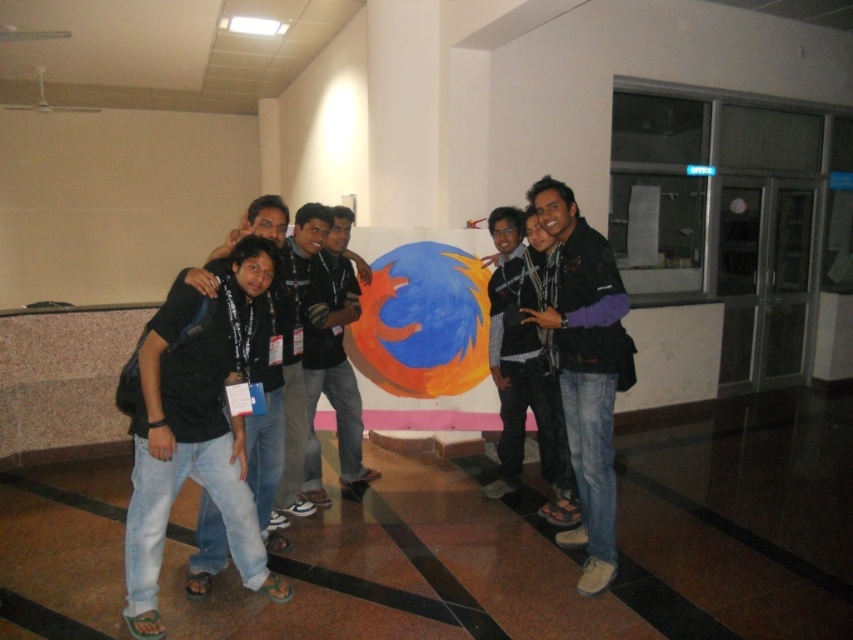
Does denim jeans at center appear on the right side of purple fleece jacket at center?

In fact, denim jeans at center is to the left of purple fleece jacket at center.

Between point (225, 476) and point (596, 435), which one is positioned in front?

Point (225, 476) is in front.

You are a GUI agent. You are given a task and a screenshot of the screen. Output one action in this format:
    pyautogui.click(x=<x>, y=<y>)
    Task: Click on the denim jeans at center
    This screenshot has height=640, width=853.
    Given the screenshot: What is the action you would take?
    pyautogui.click(x=187, y=451)

Is point (595, 532) positioned before point (339, 403)?

Yes, point (595, 532) is in front of point (339, 403).

The image size is (853, 640). What are the coordinates of `purple fleece jacket at center` in the screenshot? It's located at (584, 369).

Is the position of denim jeans at center less distant than that of black matte shirt at center?

Yes, it is.

Locate an element on the screen. The image size is (853, 640). denim jeans at center is located at coordinates (187, 451).

Does point (180, 429) lie in front of point (289, 307)?

Yes, it is in front of point (289, 307).

The image size is (853, 640). In order to click on denim jeans at center in this screenshot , I will do `click(187, 451)`.